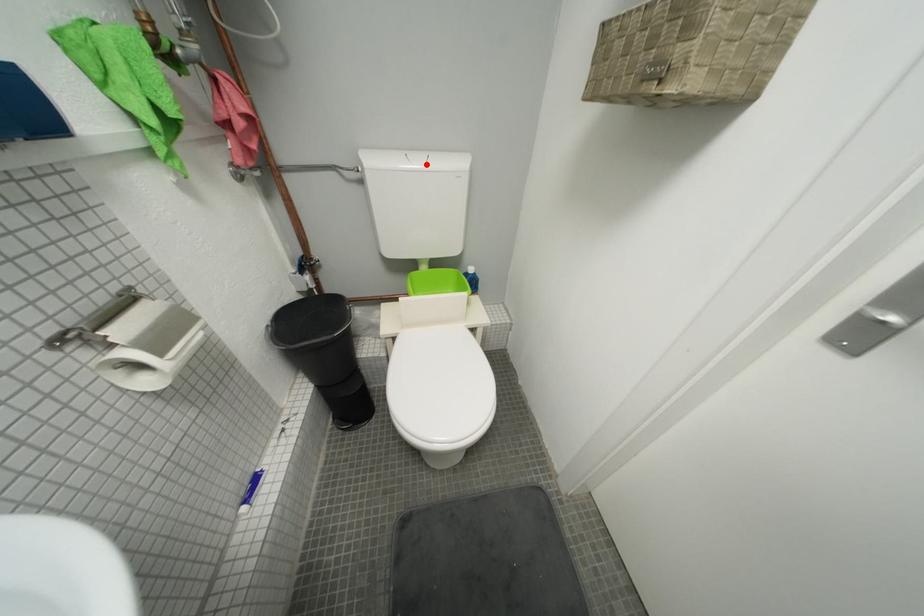
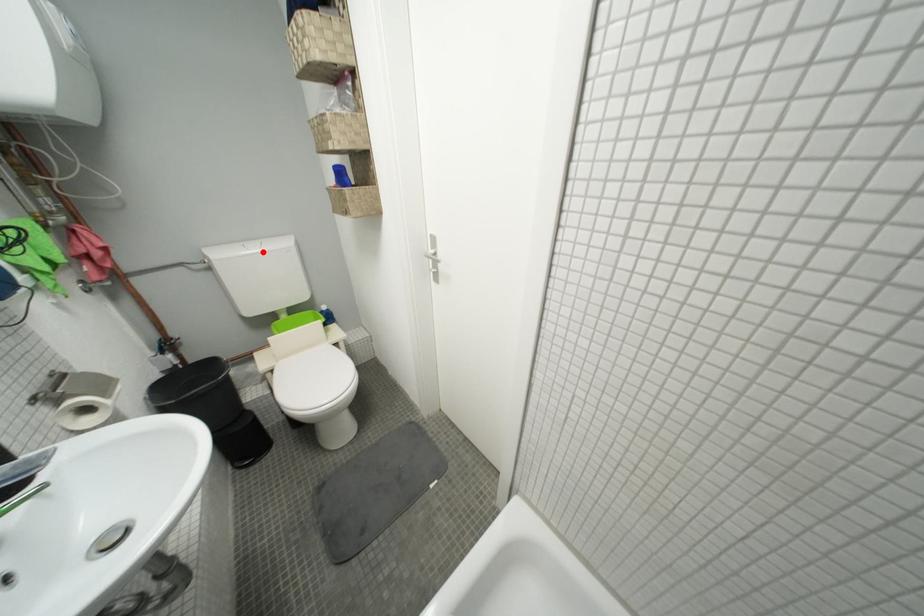
I am providing you with two images of the same scene from different viewpoints. A red point is marked on the first image and another point is marked on the second image. Do the highlighted points in image1 and image2 indicate the same real-world spot?

Yes